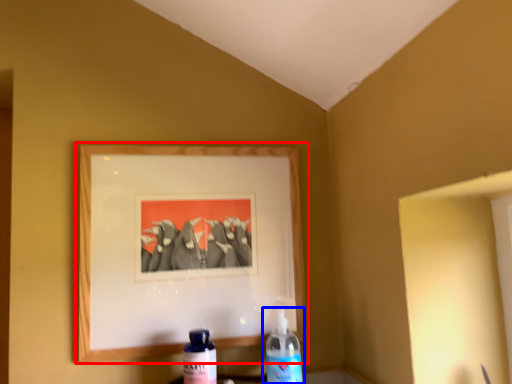
Question: Which point is further to the camera, picture frame (highlighted by a red box) or bottle (highlighted by a blue box)?

Choices:
 (A) picture frame
 (B) bottle

Answer: (A)